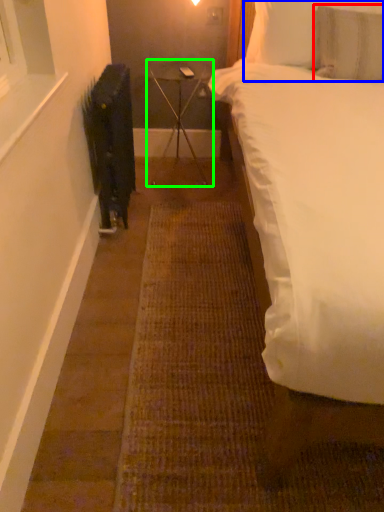
Question: Estimate the real-world distances between objects in this image. Which object is farther from pillow (highlighted by a red box), pillow (highlighted by a blue box) or table (highlighted by a green box)?

Choices:
 (A) pillow
 (B) table

Answer: (B)